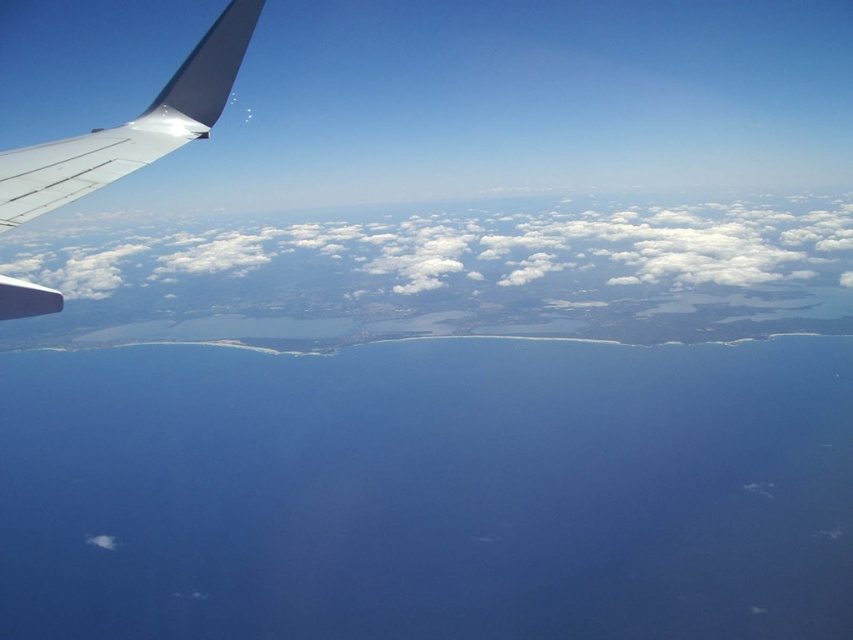
Which is more to the left, blue water at center or white fluffy cloud at center?

white fluffy cloud at center is more to the left.

Is point (206, 518) in front of point (62, 257)?

Yes, point (206, 518) is in front of point (62, 257).

Does point (165, 410) come behind point (695, 204)?

No, it is not.

The image size is (853, 640). Find the location of `blue water at center`. blue water at center is located at coordinates (428, 492).

Does white fluffy cloud at center appear over metallic gray wing at upper left?

Yes.

Looking at this image, who is more distant from viewer, (51, 278) or (173, 124)?

Point (51, 278)

Is point (763, 230) in front of point (97, 148)?

No, (763, 230) is behind (97, 148).

Identify the location of white fluffy cloud at center. (477, 248).

Is blue water at center below metallic gray wing at upper left?

Indeed, blue water at center is positioned under metallic gray wing at upper left.

Between blue water at center and metallic gray wing at upper left, which one has less height?

With less height is metallic gray wing at upper left.

Between point (257, 429) and point (3, 291), which one is positioned behind?

The point (257, 429) is more distant.

This screenshot has width=853, height=640. I want to click on blue water at center, so click(x=428, y=492).